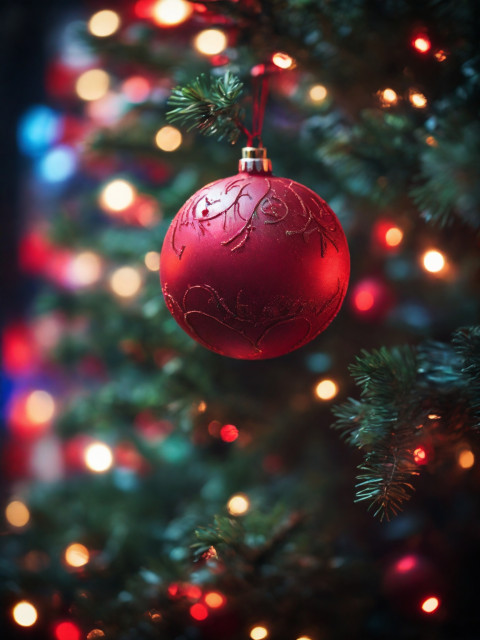
Locate an element on the screen. red lights is located at coordinates (194, 610), (67, 626).